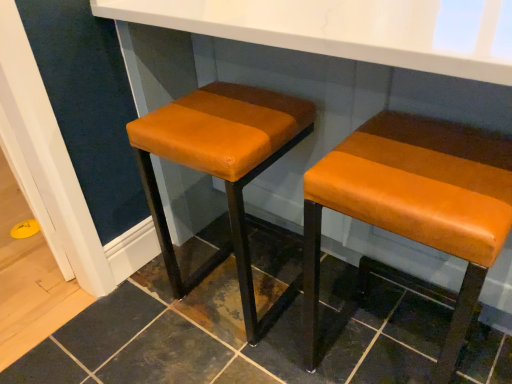
Identify the location of free location in front of orange leather stool at center, the 2th stool from the right. The image size is (512, 384). (233, 359).